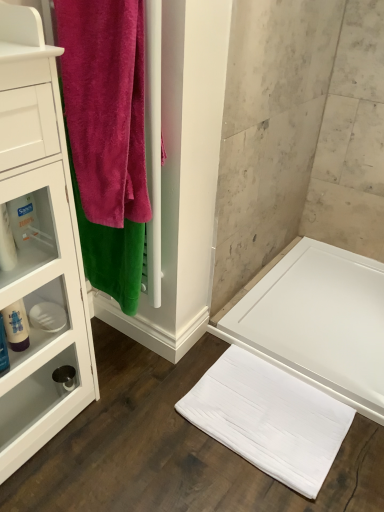
Identify the location of free area below velvety pink towel at left (from a real-world perspective). (127, 348).